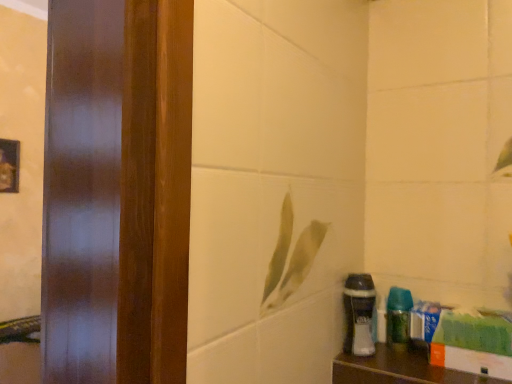
Question: Is green glossy spray bottle at lower right looking in the opposite direction of wooden shelf at lower right?

Choices:
 (A) no
 (B) yes

Answer: (A)

Question: From a real-world perspective, is green glossy spray bottle at lower right physically below wooden shelf at lower right?

Choices:
 (A) no
 (B) yes

Answer: (A)

Question: Considering the relative positions of green glossy spray bottle at lower right and wooden shelf at lower right in the image provided, is green glossy spray bottle at lower right behind wooden shelf at lower right?

Choices:
 (A) yes
 (B) no

Answer: (A)

Question: Is green glossy spray bottle at lower right not near wooden shelf at lower right?

Choices:
 (A) yes
 (B) no

Answer: (B)

Question: Can you confirm if green glossy spray bottle at lower right is thinner than wooden shelf at lower right?

Choices:
 (A) yes
 (B) no

Answer: (A)

Question: Does green glossy spray bottle at lower right have a greater width compared to wooden shelf at lower right?

Choices:
 (A) no
 (B) yes

Answer: (A)

Question: Can you confirm if wooden shelf at lower right is shorter than green glossy spray bottle at lower right?

Choices:
 (A) yes
 (B) no

Answer: (A)

Question: Is wooden shelf at lower right not within green glossy spray bottle at lower right?

Choices:
 (A) no
 (B) yes

Answer: (B)

Question: Considering the relative sizes of wooden shelf at lower right and green glossy spray bottle at lower right in the image provided, is wooden shelf at lower right smaller than green glossy spray bottle at lower right?

Choices:
 (A) yes
 (B) no

Answer: (A)

Question: Is wooden shelf at lower right aimed at green glossy spray bottle at lower right?

Choices:
 (A) no
 (B) yes

Answer: (A)

Question: Considering the relative positions of wooden shelf at lower right and green glossy spray bottle at lower right in the image provided, is wooden shelf at lower right to the left of green glossy spray bottle at lower right from the viewer's perspective?

Choices:
 (A) no
 (B) yes

Answer: (A)

Question: From the image's perspective, is wooden shelf at lower right located beneath green glossy spray bottle at lower right?

Choices:
 (A) no
 (B) yes

Answer: (B)

Question: Does white matte shaving cream at lower right have a smaller size compared to wooden shelf at lower right?

Choices:
 (A) yes
 (B) no

Answer: (B)